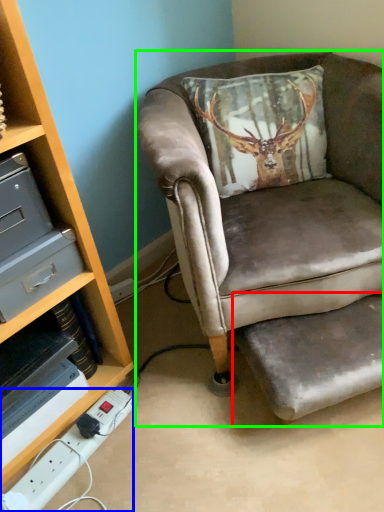
Question: Considering the real-world distances, which object is farthest from footrest (highlighted by a red box)? power outlet (highlighted by a blue box) or chair (highlighted by a green box)?

Choices:
 (A) power outlet
 (B) chair

Answer: (A)